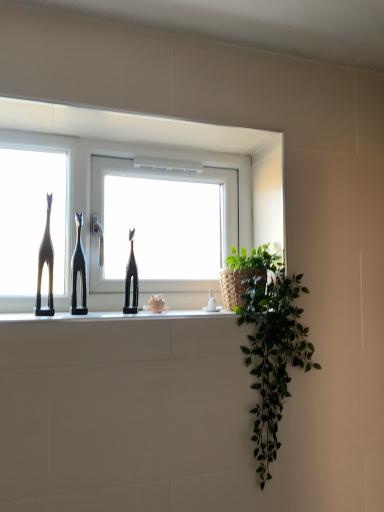
Question: In which direction should I rotate to look at black matte cat at center, positioned as the 1th sculpture in left-to-right order?

Choices:
 (A) right
 (B) left

Answer: (B)

Question: Should I look upward or downward to see black glossy giraffe at center, which appears as the 2th sculpture when viewed from the left?

Choices:
 (A) up
 (B) down

Answer: (B)

Question: Is white glossy window at center outside matte black giraffe at left?

Choices:
 (A) no
 (B) yes

Answer: (B)

Question: Considering the relative positions of white glossy window at center and matte black giraffe at left in the image provided, is white glossy window at center behind matte black giraffe at left?

Choices:
 (A) yes
 (B) no

Answer: (A)

Question: Is white glossy window at center at the right side of matte black giraffe at left?

Choices:
 (A) yes
 (B) no

Answer: (A)

Question: Is white glossy window at center at the left side of matte black giraffe at left?

Choices:
 (A) yes
 (B) no

Answer: (B)

Question: Is the surface of white glossy window at center in direct contact with matte black giraffe at left?

Choices:
 (A) no
 (B) yes

Answer: (A)

Question: Is white glossy window at center positioned in front of matte black giraffe at left?

Choices:
 (A) yes
 (B) no

Answer: (B)

Question: Is matte black giraffe at left thinner than white glossy window at center?

Choices:
 (A) yes
 (B) no

Answer: (B)

Question: Is white glossy window at center surrounded by matte black giraffe at left?

Choices:
 (A) yes
 (B) no

Answer: (B)

Question: From the image's perspective, would you say matte black giraffe at left is positioned over white glossy window at center?

Choices:
 (A) yes
 (B) no

Answer: (B)

Question: Can we say matte black giraffe at left lies outside white glossy window at center?

Choices:
 (A) no
 (B) yes

Answer: (B)

Question: Is matte black giraffe at left shorter than white glossy window at center?

Choices:
 (A) no
 (B) yes

Answer: (B)

Question: Does matte black giraffe at left touch white glossy window at center?

Choices:
 (A) no
 (B) yes

Answer: (A)

Question: Does matte black giraffe at left come in front of black matte cat at center, positioned as the 1th sculpture in left-to-right order?

Choices:
 (A) yes
 (B) no

Answer: (A)